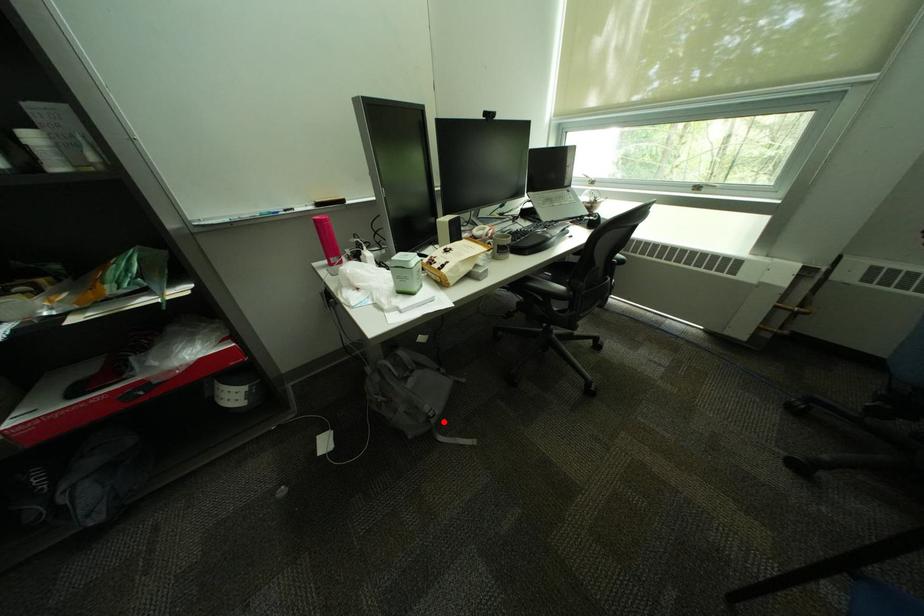
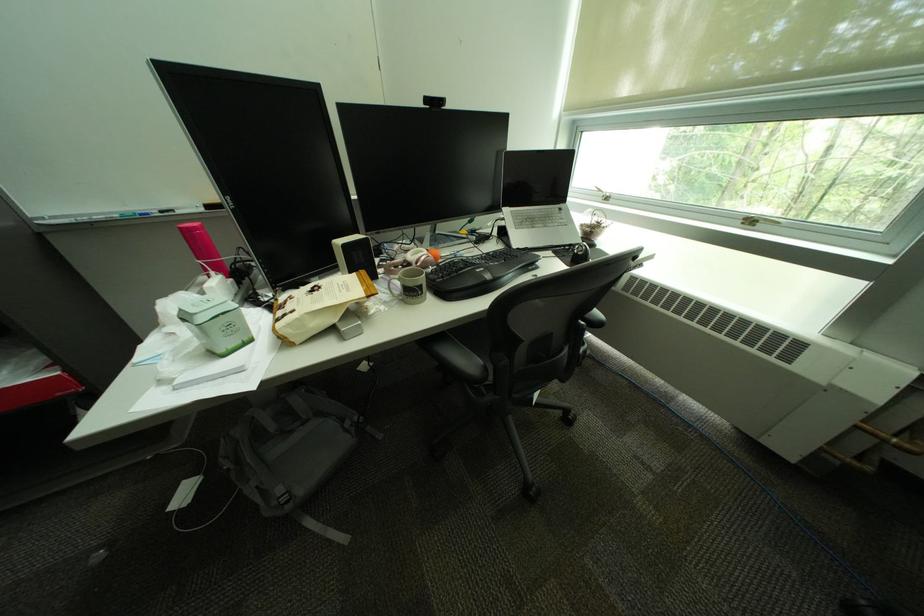
Question: A red point is marked in image1. In image2, is the corresponding 3D point closer to the camera or farther? Reply with the corresponding letter.

Choices:
 (A) The corresponding 3D point is closer.
 (B) The corresponding 3D point is farther.

Answer: (B)